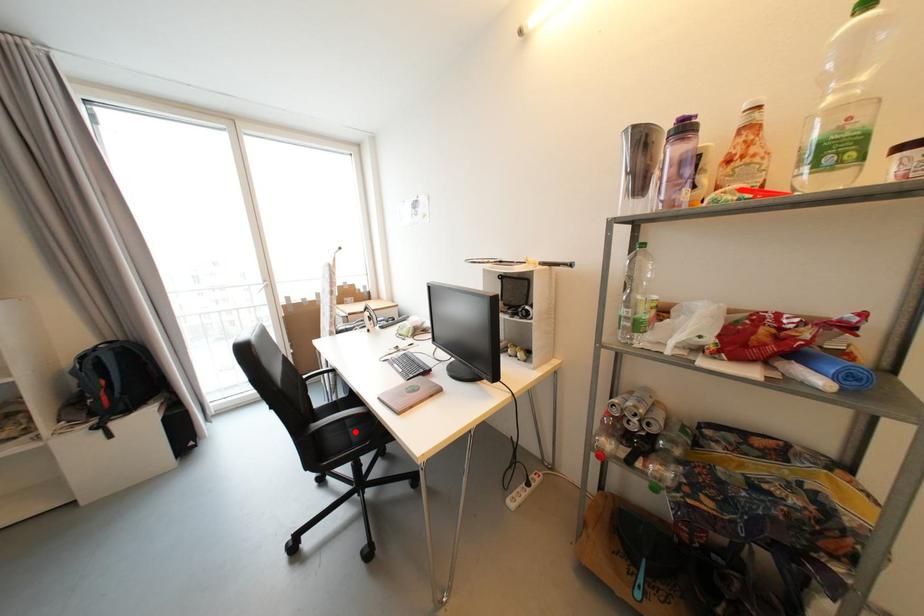
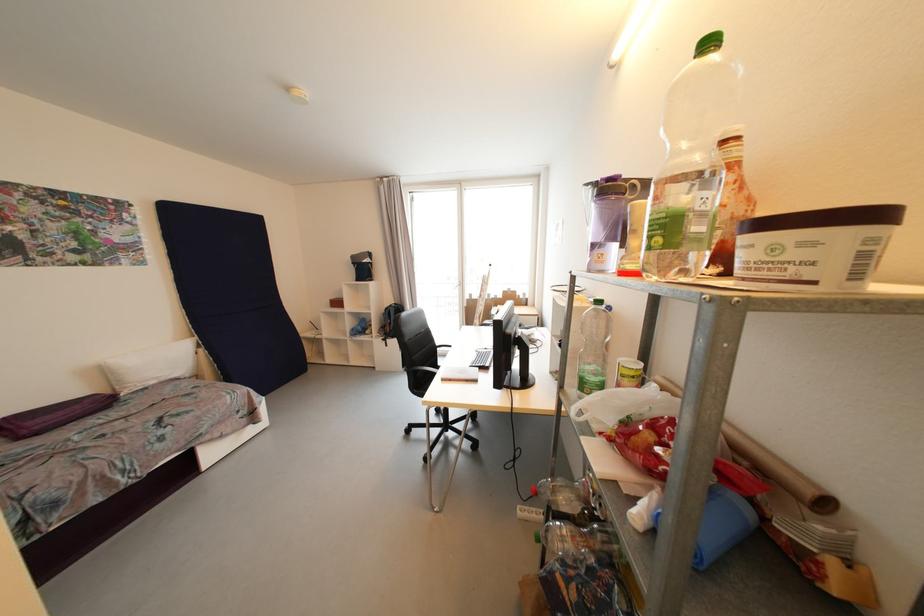
Question: I am providing you with two images of the same scene from different viewpoints. A red point is marked on the first image. Can you still see the location of the red point in image 2?

Choices:
 (A) Yes
 (B) No

Answer: (B)